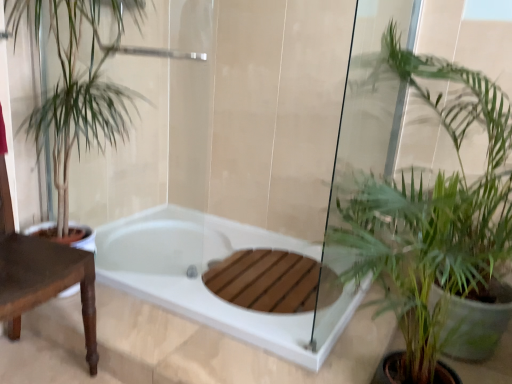
Question: In terms of width, does green leafy plant at left, which appears as the second houseplant when viewed from the right, look wider or thinner when compared to green leafy plant at lower right, the 2th houseplant when ordered from left to right?

Choices:
 (A) wide
 (B) thin

Answer: (B)

Question: Relative to green leafy plant at lower right, the 1th houseplant when ordered from right to left, is green leafy plant at left, which appears as the second houseplant when viewed from the right, in front or behind?

Choices:
 (A) front
 (B) behind

Answer: (B)

Question: Considering the real-world distances, which object is farthest from the white glossy bathtub at center?

Choices:
 (A) brown wooden table at left
 (B) green leafy plant at lower right, the 2th houseplant when ordered from left to right
 (C) green leafy plant at left, which is counted as the first houseplant, starting from the left

Answer: (B)

Question: Which of these objects is positioned closest to the green leafy plant at left, which is counted as the first houseplant, starting from the left?

Choices:
 (A) brown wooden table at left
 (B) white glossy bathtub at center
 (C) green leafy plant at lower right, the 1th houseplant when ordered from right to left

Answer: (A)